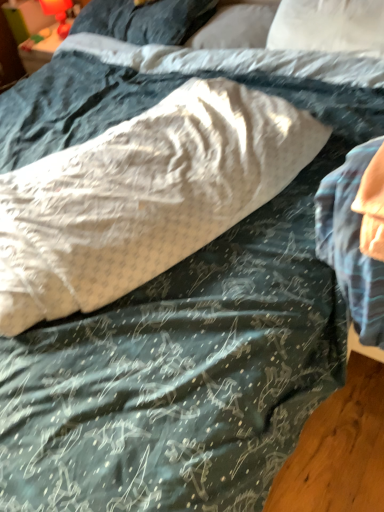
Question: From a real-world perspective, is white textured pillow at center, which appears as the fourth pillow when viewed from the top, positioned over white soft pillow at upper center, which appears as the 3th pillow when ordered from the bottom, based on gravity?

Choices:
 (A) yes
 (B) no

Answer: (A)

Question: Is white textured pillow at center, arranged as the first pillow when ordered from the bottom, thinner than white soft pillow at upper center, the second pillow positioned from the top?

Choices:
 (A) yes
 (B) no

Answer: (B)

Question: Is white textured pillow at center, which appears as the fourth pillow when viewed from the top, looking in the opposite direction of white soft pillow at upper center, which appears as the 3th pillow when ordered from the bottom?

Choices:
 (A) yes
 (B) no

Answer: (B)

Question: Is white textured pillow at center, which appears as the fourth pillow when viewed from the top, positioned before white soft pillow at upper center, which appears as the 3th pillow when ordered from the bottom?

Choices:
 (A) no
 (B) yes

Answer: (B)

Question: Does white textured pillow at center, arranged as the first pillow when ordered from the bottom, have a greater height compared to white soft pillow at upper center, the second pillow positioned from the top?

Choices:
 (A) yes
 (B) no

Answer: (A)

Question: From the image's perspective, relative to white soft pillow at upper center, the second pillow positioned from the top, is soft gray pillow at upper center, placed as the first pillow when sorted from top to bottom, above or below?

Choices:
 (A) above
 (B) below

Answer: (A)

Question: Relative to white soft pillow at upper center, which appears as the 3th pillow when ordered from the bottom, is soft gray pillow at upper center, which is the fourth pillow in bottom-to-top order, in front or behind?

Choices:
 (A) front
 (B) behind

Answer: (B)

Question: Is soft gray pillow at upper center, placed as the first pillow when sorted from top to bottom, spatially inside white soft pillow at upper center, the second pillow positioned from the top, or outside of it?

Choices:
 (A) outside
 (B) inside

Answer: (A)

Question: Looking at the image, does soft gray pillow at upper center, which is the fourth pillow in bottom-to-top order, seem bigger or smaller compared to white soft pillow at upper center, the second pillow positioned from the top?

Choices:
 (A) small
 (B) big

Answer: (B)

Question: Looking at their shapes, would you say white soft pillow at upper center, the second pillow in the bottom-to-top sequence, is wider or thinner than soft gray pillow at upper center, which is the fourth pillow in bottom-to-top order?

Choices:
 (A) thin
 (B) wide

Answer: (A)

Question: From the image's perspective, is white soft pillow at upper center, the second pillow in the bottom-to-top sequence, positioned above or below soft gray pillow at upper center, placed as the first pillow when sorted from top to bottom?

Choices:
 (A) above
 (B) below

Answer: (B)

Question: Does point (334, 17) appear closer or farther from the camera than point (92, 20)?

Choices:
 (A) closer
 (B) farther

Answer: (A)

Question: In terms of height, does white soft pillow at upper center, the second pillow in the bottom-to-top sequence, look taller or shorter compared to soft gray pillow at upper center, which is the fourth pillow in bottom-to-top order?

Choices:
 (A) short
 (B) tall

Answer: (B)

Question: Is point (79, 259) closer or farther from the camera than point (339, 22)?

Choices:
 (A) closer
 (B) farther

Answer: (A)

Question: Is white textured pillow at center, which appears as the fourth pillow when viewed from the top, spatially inside white soft pillow at upper center, which is the third pillow from top to bottom, or outside of it?

Choices:
 (A) inside
 (B) outside

Answer: (B)